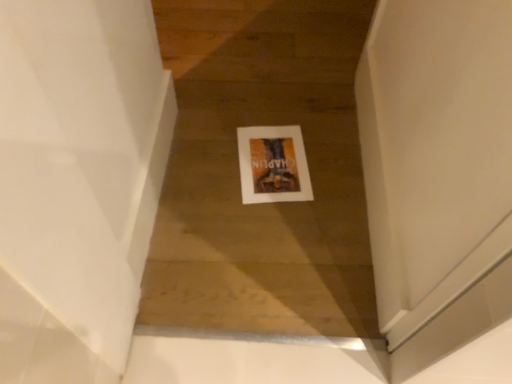
Question: Is white matte picture frame at center bigger than white glossy wall at upper left?

Choices:
 (A) no
 (B) yes

Answer: (A)

Question: Is white glossy wall at upper left completely or partially inside white matte picture frame at center?

Choices:
 (A) no
 (B) yes

Answer: (A)

Question: Considering the relative positions of white matte picture frame at center and white glossy wall at upper left in the image provided, is white matte picture frame at center to the right of white glossy wall at upper left from the viewer's perspective?

Choices:
 (A) no
 (B) yes

Answer: (B)

Question: Can you confirm if white matte picture frame at center is wider than white glossy wall at upper left?

Choices:
 (A) yes
 (B) no

Answer: (A)

Question: Would you consider white matte picture frame at center to be distant from white glossy wall at upper left?

Choices:
 (A) no
 (B) yes

Answer: (A)

Question: Is white matte picture frame at center shorter than white glossy wall at upper left?

Choices:
 (A) no
 (B) yes

Answer: (B)

Question: From the image's perspective, is white glossy wall at upper left below white matte picture frame at center?

Choices:
 (A) yes
 (B) no

Answer: (A)

Question: Does white glossy wall at upper left have a greater height compared to white matte picture frame at center?

Choices:
 (A) no
 (B) yes

Answer: (B)

Question: From a real-world perspective, is white glossy wall at upper left positioned under white matte picture frame at center based on gravity?

Choices:
 (A) no
 (B) yes

Answer: (A)

Question: Is white glossy wall at upper left wider than white matte picture frame at center?

Choices:
 (A) no
 (B) yes

Answer: (A)

Question: Is the depth of white glossy wall at upper left less than that of white matte picture frame at center?

Choices:
 (A) no
 (B) yes

Answer: (B)

Question: Considering the relative positions of white glossy wall at upper left and white matte picture frame at center in the image provided, is white glossy wall at upper left to the left of white matte picture frame at center from the viewer's perspective?

Choices:
 (A) no
 (B) yes

Answer: (B)

Question: From the image's perspective, is white glossy wall at upper left above or below white matte picture frame at center?

Choices:
 (A) below
 (B) above

Answer: (A)